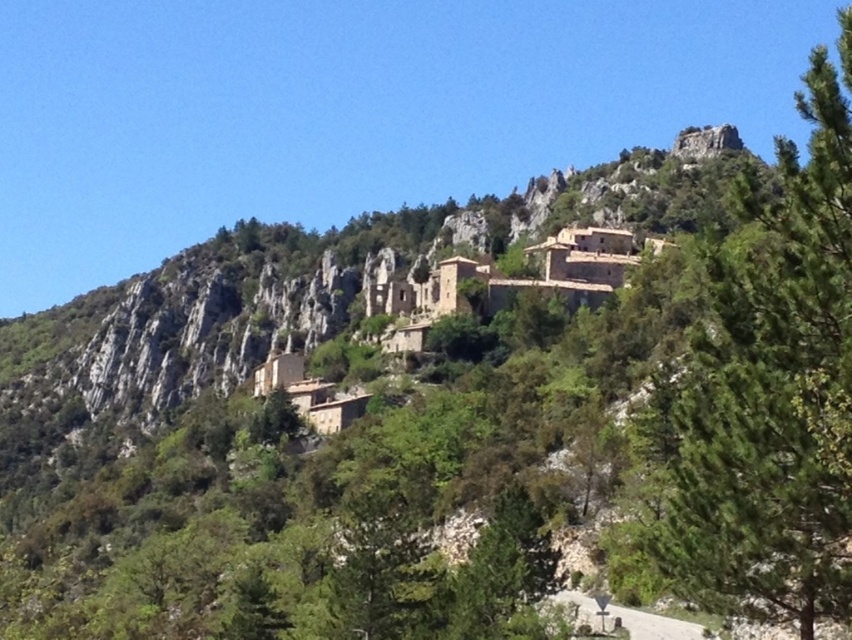
Question: Which of the following is the closest to the observer?

Choices:
 (A) green leafy tree at upper right
 (B) brown stone buildings at center

Answer: (A)

Question: Does green leafy tree at upper right appear on the right side of brown stone buildings at center?

Choices:
 (A) yes
 (B) no

Answer: (A)

Question: Can you confirm if green leafy tree at upper right is positioned above brown stone buildings at center?

Choices:
 (A) yes
 (B) no

Answer: (A)

Question: From the image, what is the correct spatial relationship of green leafy tree at upper right in relation to brown stone buildings at center?

Choices:
 (A) left
 (B) right

Answer: (B)

Question: Which object is farther from the camera taking this photo?

Choices:
 (A) brown stone buildings at center
 (B) green leafy tree at upper right

Answer: (A)